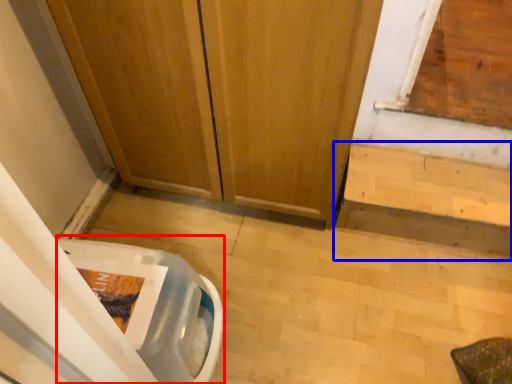
Question: Which object appears closest to the camera in this image, toilet bowl (highlighted by a red box) or stairwell (highlighted by a blue box)?

Choices:
 (A) toilet bowl
 (B) stairwell

Answer: (A)